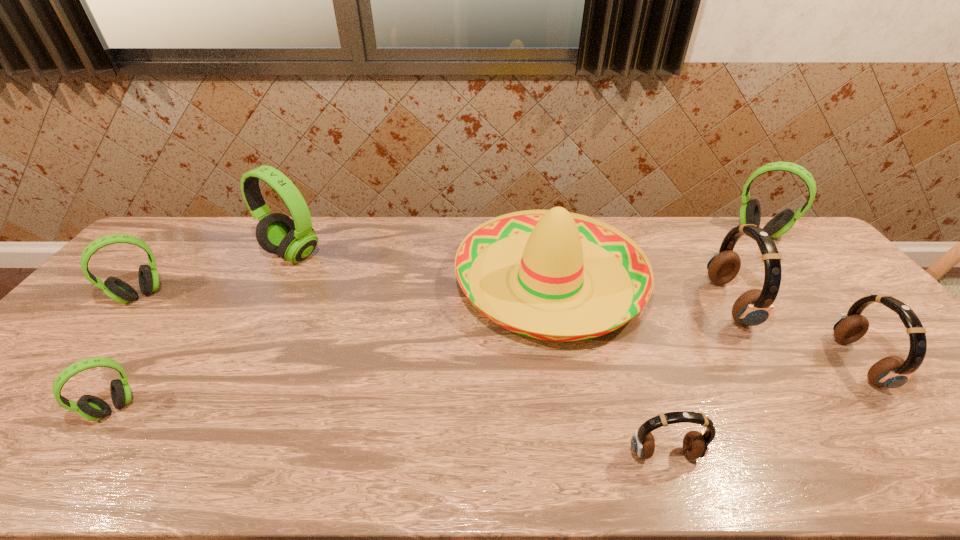
Locate an element on the screen. The height and width of the screenshot is (540, 960). free region located on the ear cup of the rightmost brown headset is located at coordinates (794, 363).

At what (x,y) coordinates should I click in order to perform the action: click on free spot located 0.350m on the ear cup of the rightmost brown headset. Please return your answer as a coordinate pair (x, y). The image size is (960, 540). Looking at the image, I should click on (707, 363).

Where is `free spot located 0.200m on the ear cup of the rightmost brown headset`? This screenshot has width=960, height=540. free spot located 0.200m on the ear cup of the rightmost brown headset is located at coordinates (x=766, y=363).

Find the location of a particular element. The width and height of the screenshot is (960, 540). vacant point located on the right of the second green headset from left to right is located at coordinates (187, 408).

Locate an element on the screen. The height and width of the screenshot is (540, 960). sombrero at the far edge is located at coordinates (555, 247).

The image size is (960, 540). Identify the location of object situated at the near edge. (696, 444).

Identify the location of object present at the left edge. This screenshot has width=960, height=540. (118, 290).

Identify the location of object that is at the far right corner. (750, 212).

The height and width of the screenshot is (540, 960). I want to click on free region at the far edge of the desktop, so click(x=289, y=217).

Where is `vacant region at the near edge of the desktop`? The width and height of the screenshot is (960, 540). vacant region at the near edge of the desktop is located at coordinates (875, 461).